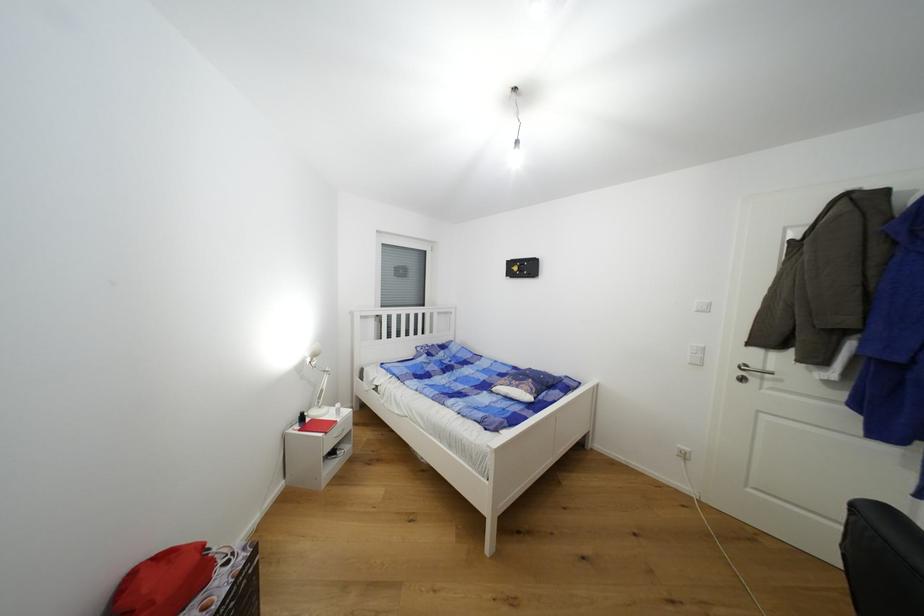
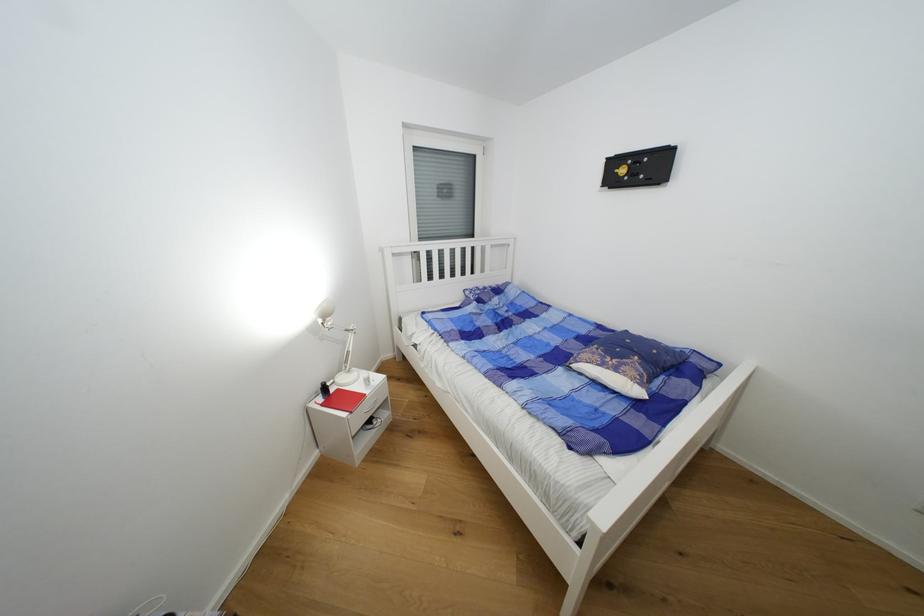
In the second image, find the point that corresponds to (523,387) in the first image.

(622, 371)